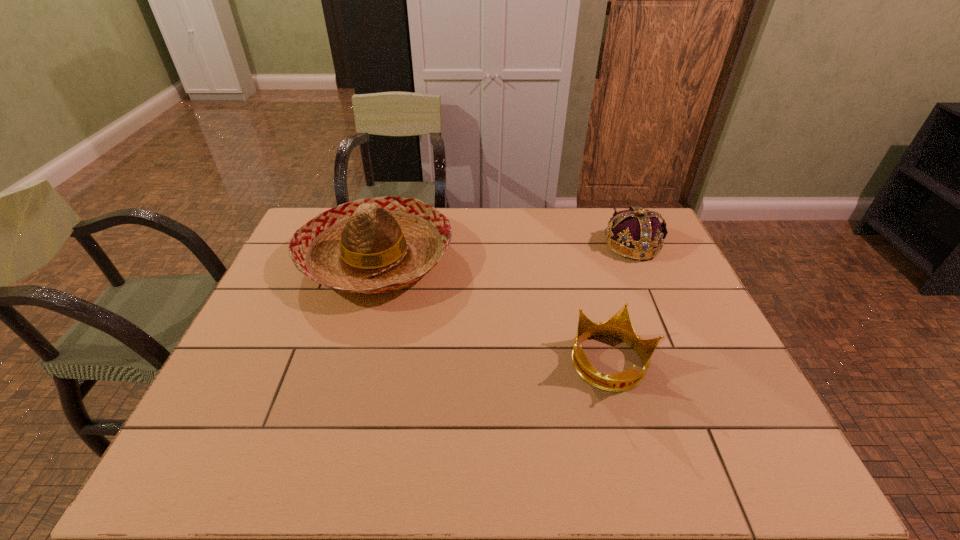
This screenshot has width=960, height=540. I want to click on vacant space in between the shortest object and the sombrero, so click(493, 310).

Locate an element on the screen. vacant space that is in between the shortest object and the leftmost object is located at coordinates (493, 310).

Where is `vacant area that lies between the second tallest object and the leftmost object`? This screenshot has width=960, height=540. vacant area that lies between the second tallest object and the leftmost object is located at coordinates (504, 252).

At what (x,y) coordinates should I click in order to perform the action: click on vacant point located between the nearest object and the second tallest object. Please return your answer as a coordinate pair (x, y). The image size is (960, 540). Looking at the image, I should click on (621, 304).

You are a GUI agent. You are given a task and a screenshot of the screen. Output one action in this format:
    pyautogui.click(x=<x>, y=<y>)
    Task: Click on the free spot between the nearer crown and the leftmost object
    
    Given the screenshot: What is the action you would take?
    tap(493, 310)

Find the location of a particular element. The image size is (960, 540). unoccupied area between the sombrero and the nearest object is located at coordinates (493, 310).

Find the location of a particular element. Image resolution: width=960 pixels, height=540 pixels. free point between the farther crown and the nearest object is located at coordinates (621, 304).

You are a GUI agent. You are given a task and a screenshot of the screen. Output one action in this format:
    pyautogui.click(x=<x>, y=<y>)
    Task: Click on the vacant area that lies between the leftmost object and the shorter crown
    This screenshot has height=540, width=960.
    Given the screenshot: What is the action you would take?
    pyautogui.click(x=493, y=310)

The width and height of the screenshot is (960, 540). In order to click on free area in between the tallest object and the nearer crown in this screenshot , I will do `click(493, 310)`.

Where is `free area in between the taller crown and the shortest object`? This screenshot has height=540, width=960. free area in between the taller crown and the shortest object is located at coordinates (621, 304).